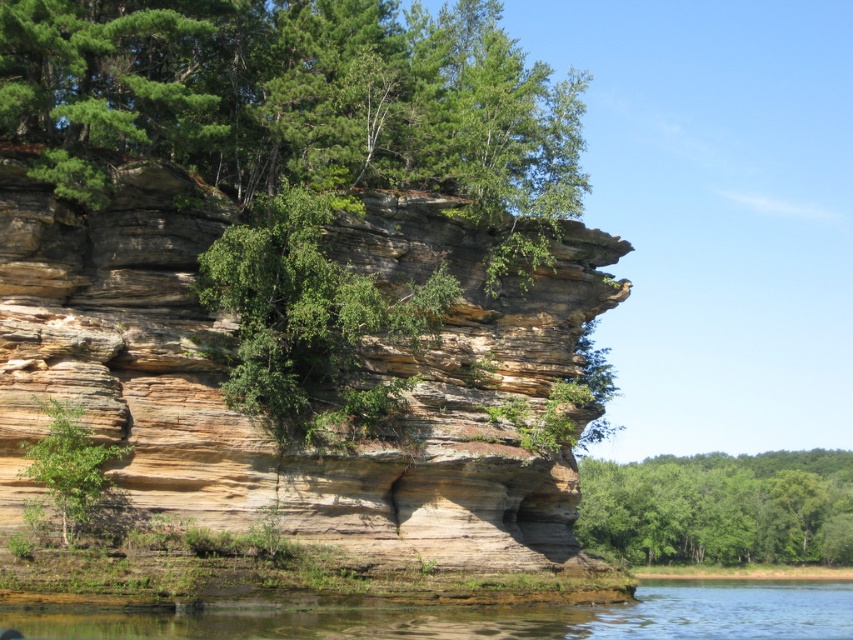
You are standing at the base of the cliff and want to reach the point marked as point (257,420). Based on the image, is this point located on the brown rocky cliff at center?

Yes, the brown rocky cliff at center is located at point (257,420), so the point is on the cliff.